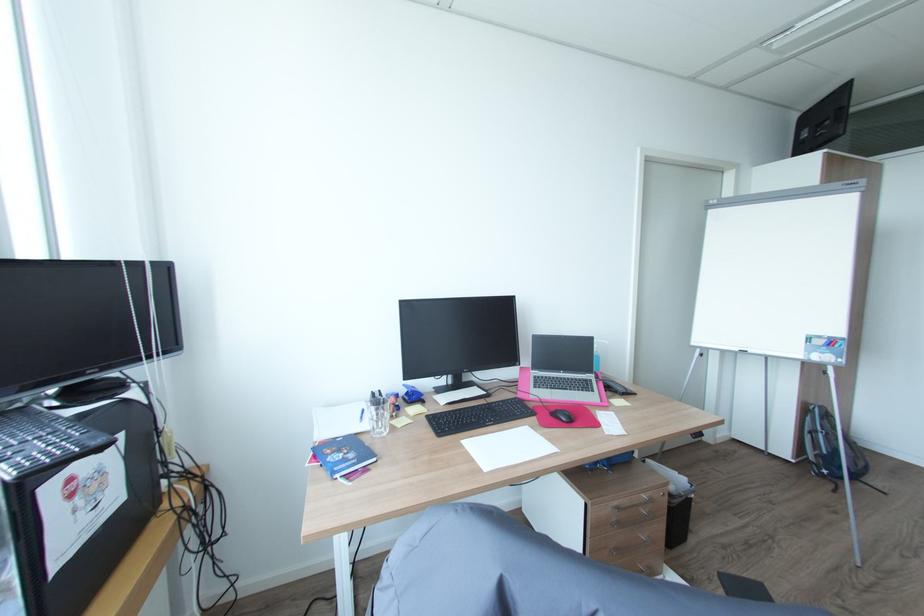
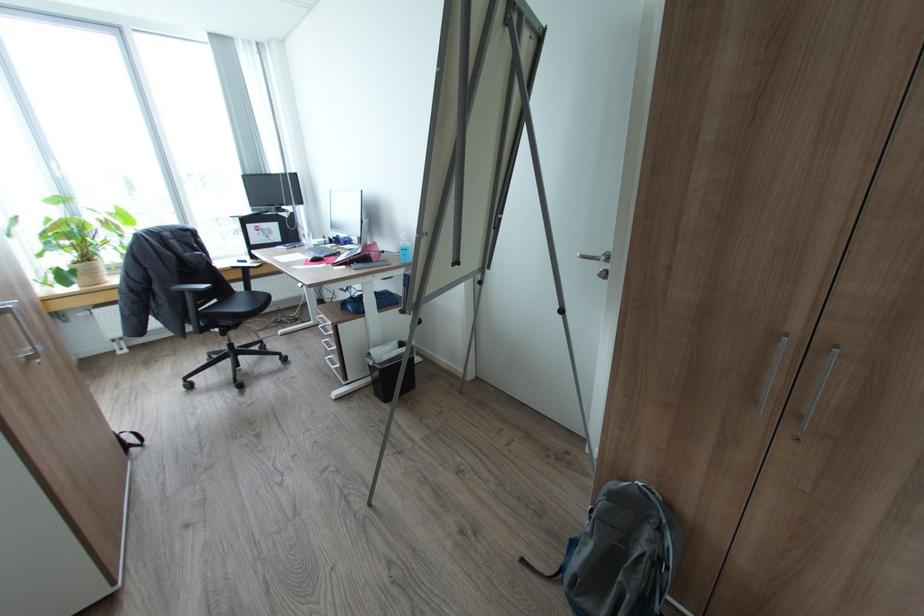
Where in the second image is the point corresponding to (x=840, y=491) from the first image?

(527, 560)